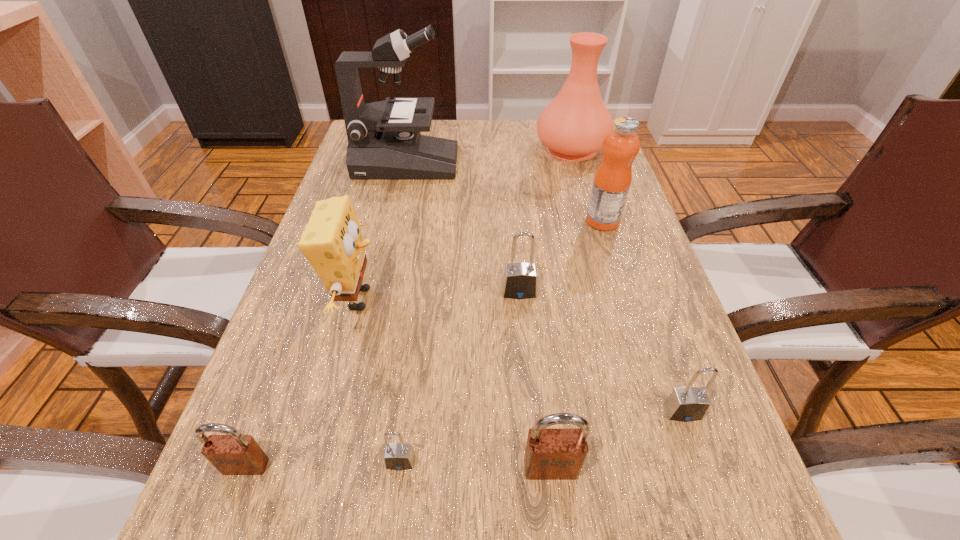
This screenshot has width=960, height=540. I want to click on vacant space located on the front-facing side of the left brown padlock, so [x=222, y=531].

This screenshot has height=540, width=960. Identify the location of free space located 0.050m on the shackle of the smallest gray padlock. (395, 509).

At what (x,y) coordinates should I click in order to perform the action: click on microscope present at the far edge. Please return your answer as a coordinate pair (x, y). Image resolution: width=960 pixels, height=540 pixels. Looking at the image, I should click on (384, 141).

Where is `vase that is at the far edge`? vase that is at the far edge is located at coordinates (573, 126).

You are a GUI agent. You are given a task and a screenshot of the screen. Output one action in this format:
    pyautogui.click(x=<x>, y=<y>)
    Task: Click on the microscope positioned at the left edge
    This screenshot has width=960, height=540.
    Given the screenshot: What is the action you would take?
    pyautogui.click(x=384, y=141)

Where is `sponge that is positioned at the left edge`? The width and height of the screenshot is (960, 540). sponge that is positioned at the left edge is located at coordinates (332, 242).

Locate an element on the screen. The height and width of the screenshot is (540, 960). padlock located in the left edge section of the desktop is located at coordinates (233, 454).

At what (x,y) coordinates should I click in order to perform the action: click on vase at the right edge. Please return your answer as a coordinate pair (x, y). This screenshot has width=960, height=540. Looking at the image, I should click on (573, 126).

The height and width of the screenshot is (540, 960). Identify the location of fruit juice present at the right edge. (612, 180).

Image resolution: width=960 pixels, height=540 pixels. I want to click on padlock present at the right edge, so click(685, 404).